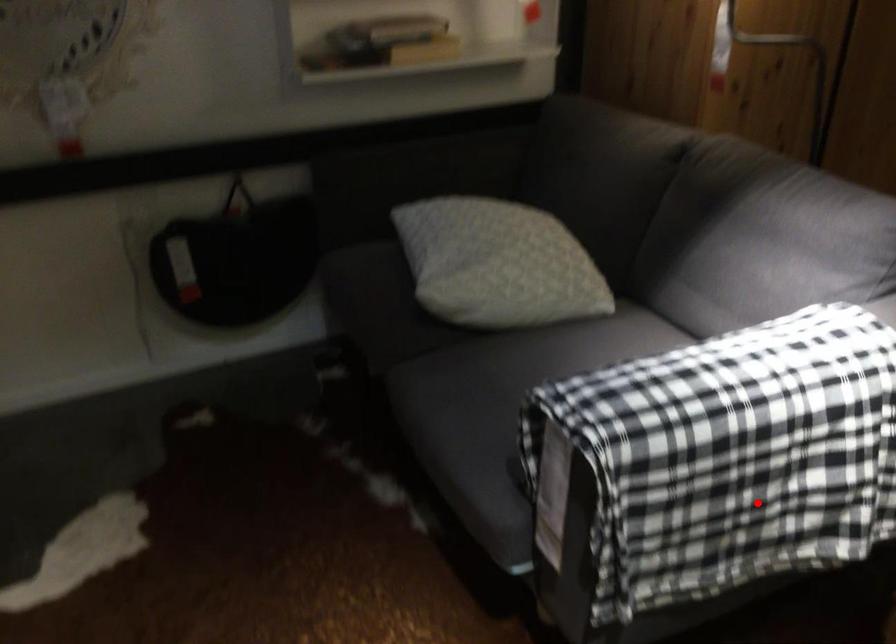
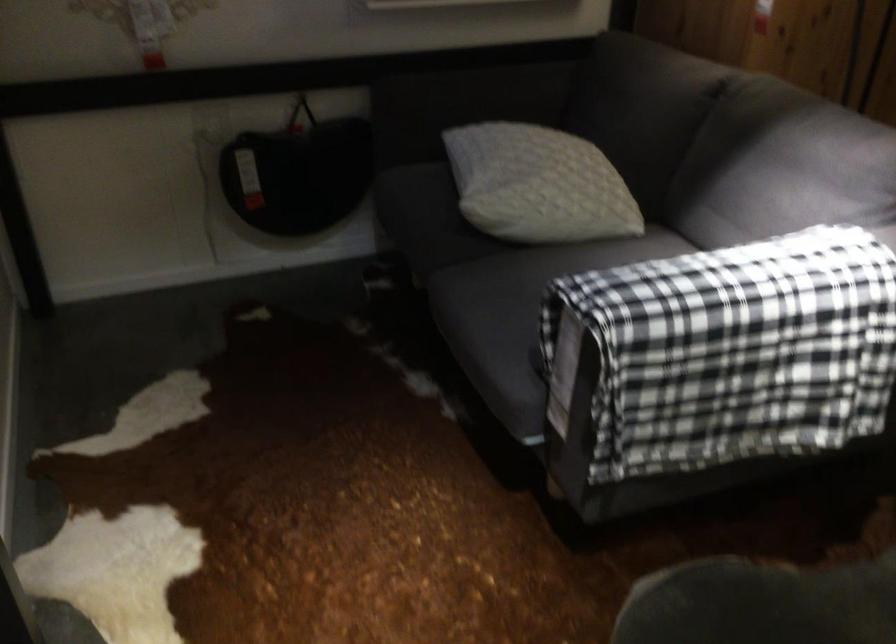
Question: I am providing you with two images of the same scene from different viewpoints. Given a red point in image1, look at the same physical point in image2. Is it:

Choices:
 (A) Closer to the viewpoint
 (B) Farther from the viewpoint

Answer: (B)